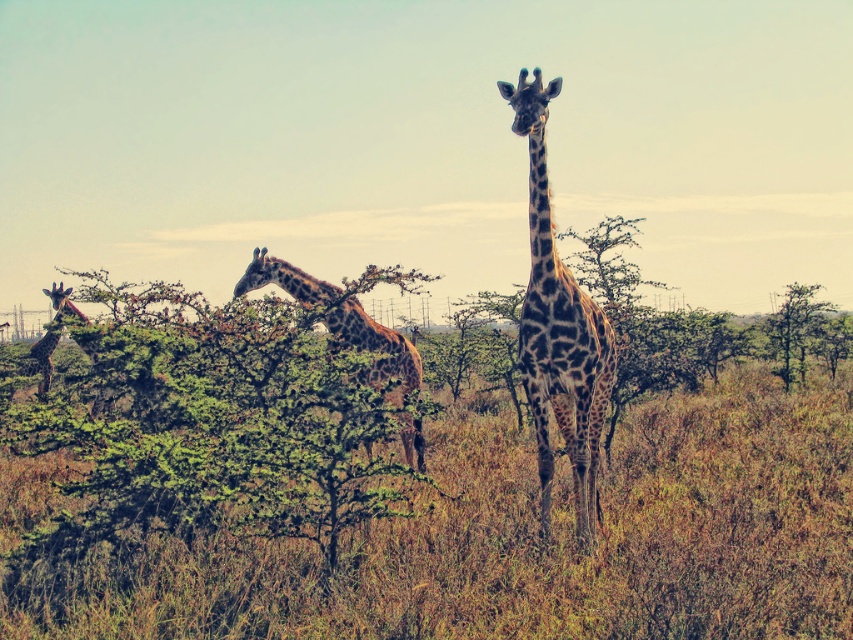
In the savanna scene, there is a green leafy bush at center and a spotted fur giraffe at center. Which object occupies more horizontal space in the image?

The green leafy bush at center might be wider than the spotted fur giraffe at center.

You are a photographer trying to capture a clear photo of the spotted brown giraffe at center and the spotted fur giraffe at left. Which giraffe will appear closer to the camera in the photo?

The spotted brown giraffe at center will appear closer to the camera in the photo because it is in front of the spotted fur giraffe at left.

You are a photographer trying to capture the spotted fur giraffe at left in your shot. However, you notice the brown dry grass at center is blocking your view. Based on their positions, can you move the grass to get a clear shot of the giraffe?

The brown dry grass at center is in front of the spotted fur giraffe at left, so you cannot move the grass to get a clear shot of the giraffe since the grass is blocking the view.